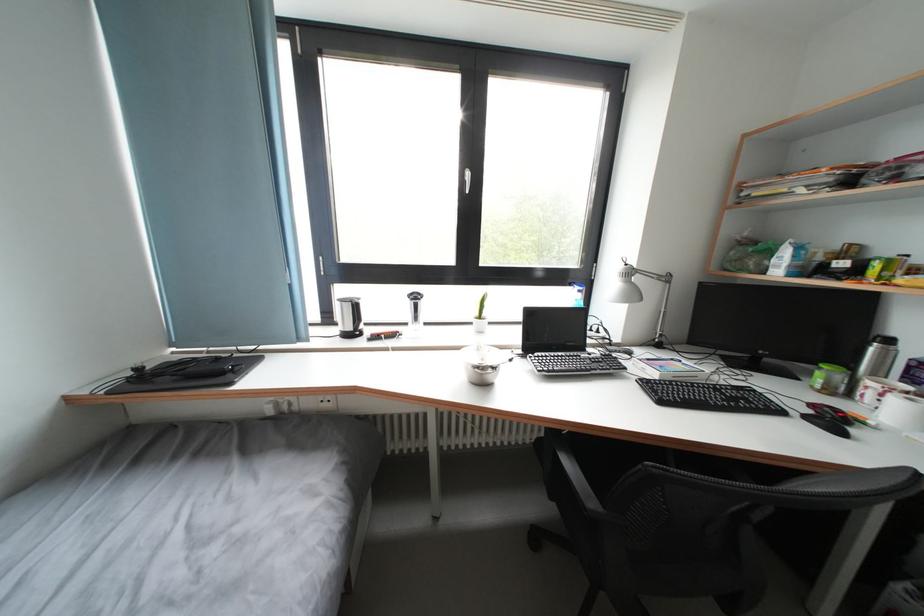
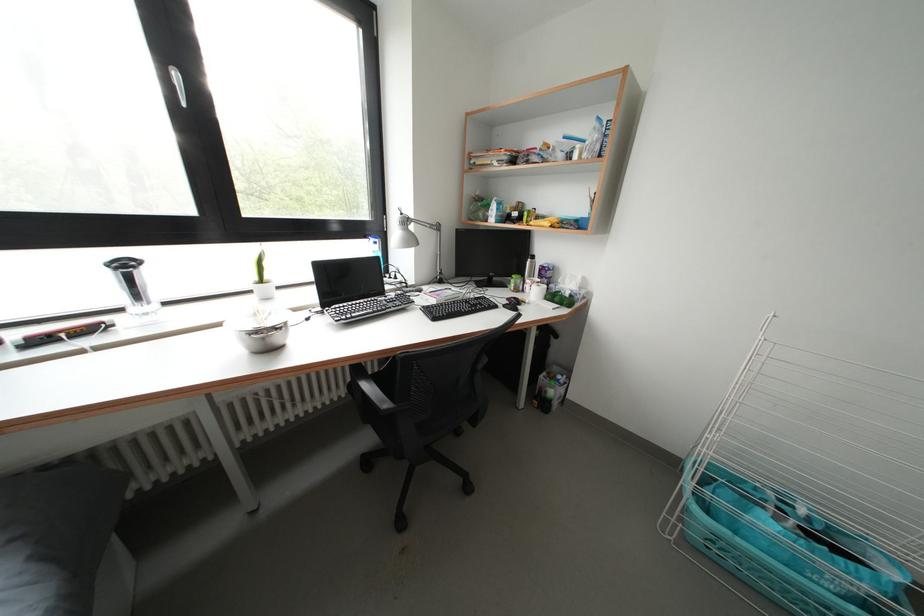
In the second image, find the point that corresponds to the point at 577,290 in the first image.

(371, 241)